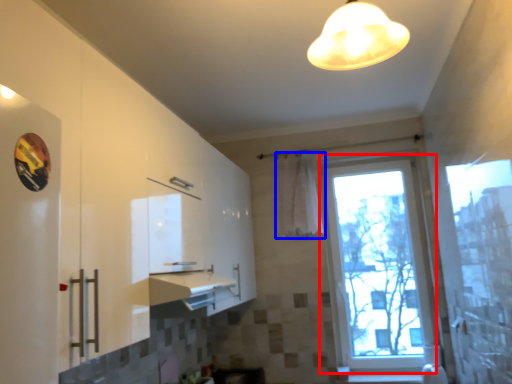
Question: Which object is further to the camera taking this photo, window (highlighted by a red box) or curtain (highlighted by a blue box)?

Choices:
 (A) window
 (B) curtain

Answer: (B)